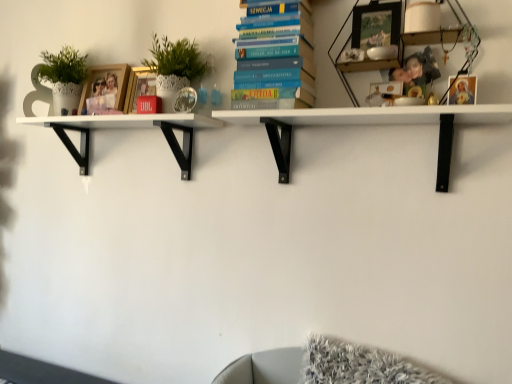
Question: Based on their sizes in the image, would you say wooden photo frame at upper right, which is counted as the 3th shelf, starting from the left, is bigger or smaller than gold metallic picture frame at upper center, which ranks as the 2th picture frame in left-to-right order?

Choices:
 (A) small
 (B) big

Answer: (B)

Question: From a real-world perspective, relative to gold metallic picture frame at upper center, the third picture frame positioned from the right, is wooden photo frame at upper right, which is counted as the 3th shelf, starting from the left, vertically above or below?

Choices:
 (A) above
 (B) below

Answer: (A)

Question: Which object is the farthest from the blue hardcover book at center?

Choices:
 (A) metallic silver picture frame at upper right, the second picture frame positioned from the right
 (B) white matte shelf at left, arranged as the third shelf when viewed from the right
 (C) wooden photo frame at upper right, positioned as the first shelf in right-to-left order
 (D) white matte shelf at center, the 2th shelf when ordered from left to right
 (E) wooden photo frame at upper left, which ranks as the fourth picture frame in right-to-left order

Answer: (E)

Question: Estimate the real-world distances between objects in this image. Which object is closer to the wooden photo frame at upper right, positioned as the first shelf in right-to-left order?

Choices:
 (A) white matte shelf at left, arranged as the third shelf when viewed from the right
 (B) blue hardcover book at center
 (C) wooden photo frame at upper left, which ranks as the fourth picture frame in right-to-left order
 (D) metallic silver picture frame at upper right, the third picture frame viewed from the left
 (E) gold metallic picture frame at upper center, the third picture frame positioned from the right

Answer: (D)